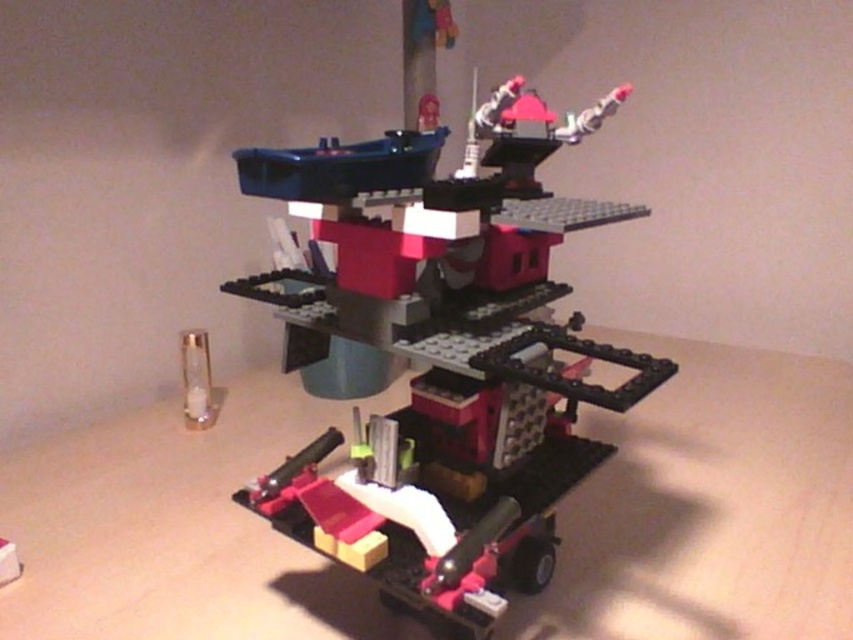
Which is more to the left, black plastic table at center or brick-like plastic tower at center?

Positioned to the left is brick-like plastic tower at center.

Between point (679, 582) and point (579, 458), which one is positioned behind?

Point (579, 458)

What do you see at coordinates (709, 506) in the screenshot?
I see `black plastic table at center` at bounding box center [709, 506].

Where is `black plastic table at center`? black plastic table at center is located at coordinates (709, 506).